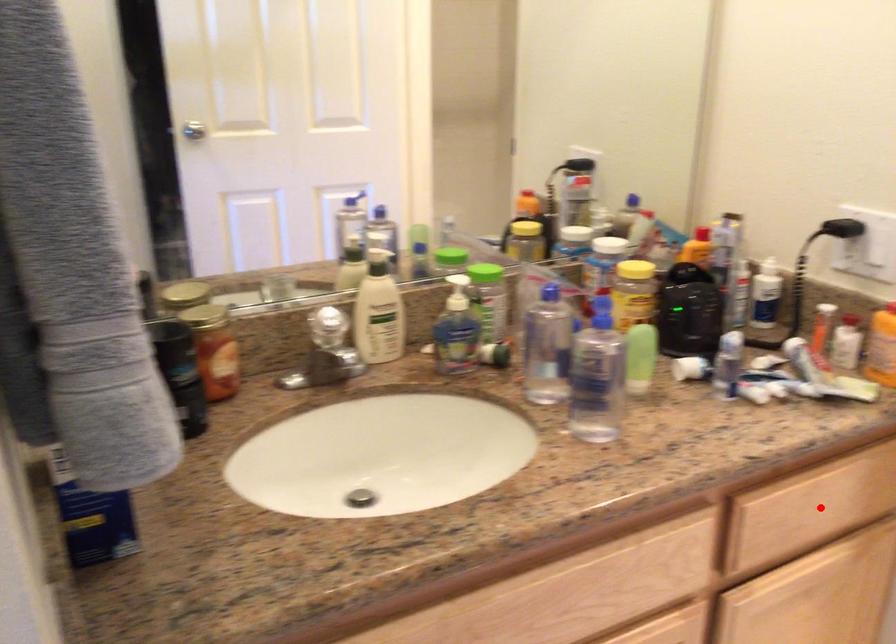
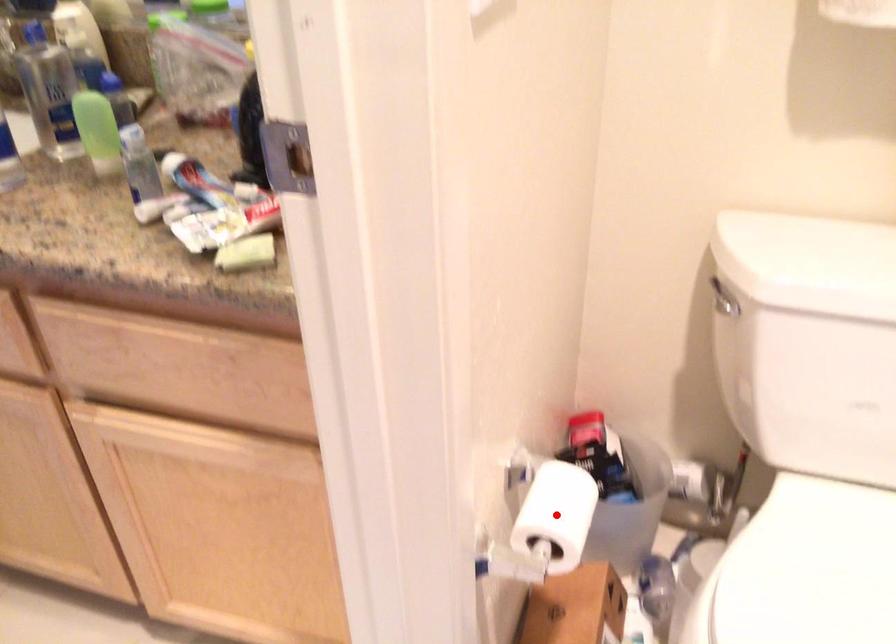
I am providing you with two images of the same scene from different viewpoints. A red point is marked on the first image and another point is marked on the second image. Is the marked point in image1 the same physical position as the marked point in image2?

No